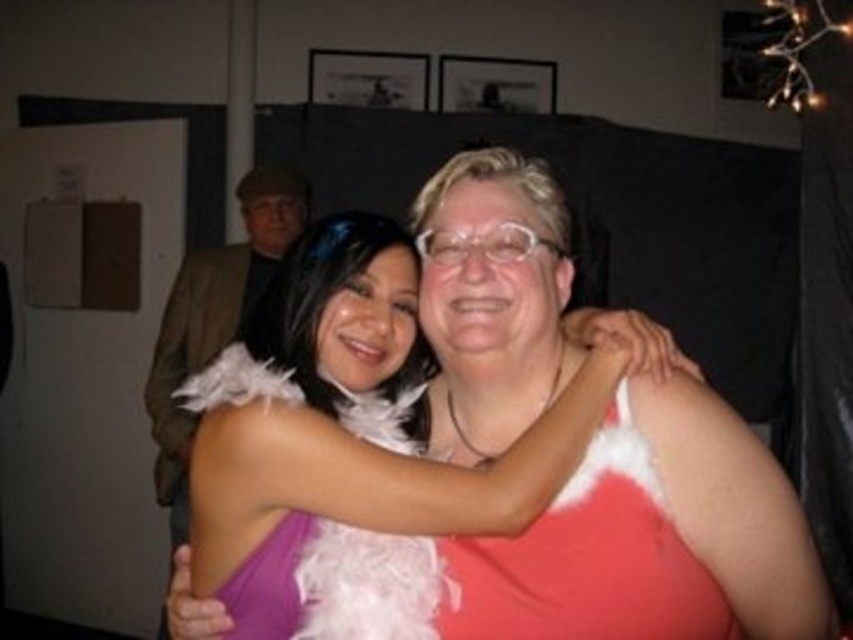
You are standing in the same room as the people in the image. You want to move from the point at coordinate (511, 180) to the point at coordinate (276, 176). Which direction should you move to get closer to the second point?

To move from point (511, 180) to point (276, 176), you should move downward and slightly to the left since the second point is lower and slightly leftward compared to the first point.

You are a photographer standing at a certain distance from the scene. You want to capture a closeup shot of the white feather boa at center. Given that your camera requires a minimum distance of 36 inches to focus properly, will you be able to take the photo without moving closer?

The white feather boa at center is 37.09 inches away from the camera, which is beyond the minimum required distance of 36 inches. Therefore, you can take the closeup shot without moving closer.

You are standing in the scene and want to reach the point at coordinate point (556, 634). If your arm can extend 40 inches, can you reach it?

The point at coordinate point (556, 634) is 37.53 inches away from the viewer, so yes, you can reach it since your arm can extend 40 inches which is longer than the distance required.